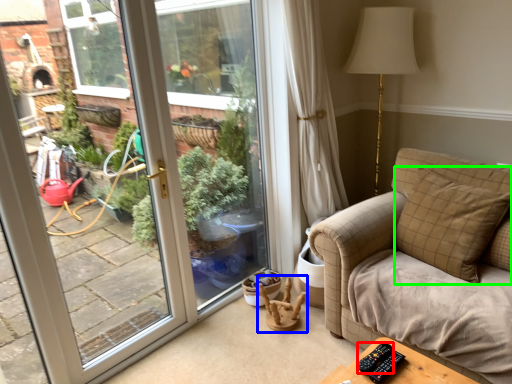
Question: Based on their relative distances, which object is nearer to remote (highlighted by a red box)? Choose from rocking chair (highlighted by a blue box) and pillow (highlighted by a green box).

Choices:
 (A) rocking chair
 (B) pillow

Answer: (B)